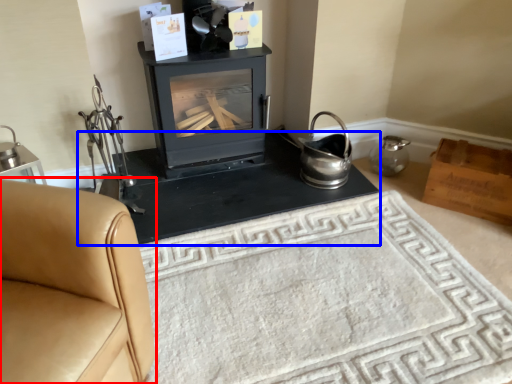
Question: Among these objects, which one is farthest to the camera, furniture (highlighted by a red box) or table (highlighted by a blue box)?

Choices:
 (A) furniture
 (B) table

Answer: (B)